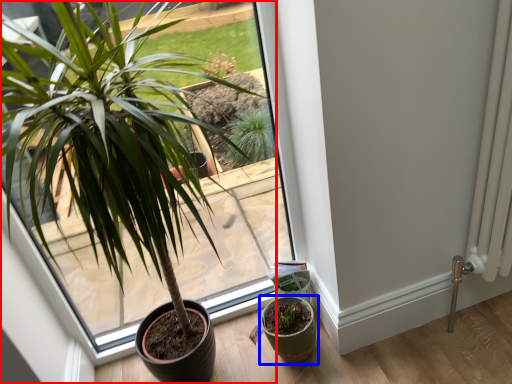
Question: Which object is closer to the camera taking this photo, houseplant (highlighted by a red box) or flowerpot (highlighted by a blue box)?

Choices:
 (A) houseplant
 (B) flowerpot

Answer: (A)